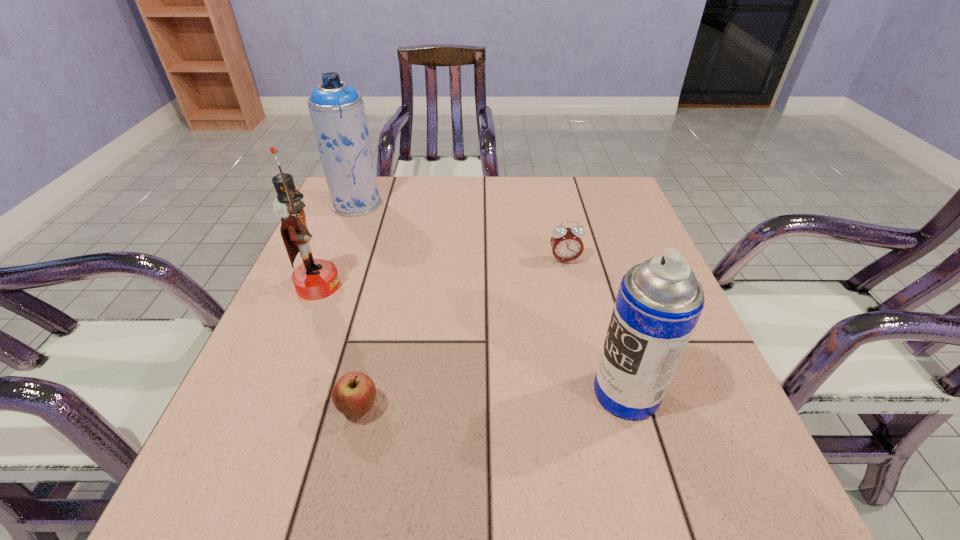
This screenshot has height=540, width=960. I want to click on the farthest object, so [x=337, y=111].

You are a GUI agent. You are given a task and a screenshot of the screen. Output one action in this format:
    pyautogui.click(x=<x>, y=<y>)
    Task: Click on the farther aerosol can
    
    Given the screenshot: What is the action you would take?
    pyautogui.click(x=337, y=111)

What are the coordinates of `the third farthest object` in the screenshot? It's located at (314, 279).

In order to click on the right aerosol can in this screenshot , I will do `click(659, 302)`.

At what (x,y) coordinates should I click in order to perform the action: click on alarm clock. Please return your answer as a coordinate pair (x, y). Looking at the image, I should click on (566, 243).

Identify the location of the second shortest object. (566, 243).

I want to click on the shortest object, so click(x=354, y=394).

Identify the location of the third object from right to left. Image resolution: width=960 pixels, height=540 pixels. (354, 394).

Find the location of a particular element. This screenshot has width=960, height=540. blank space located on the right of the farthest object is located at coordinates (440, 204).

Image resolution: width=960 pixels, height=540 pixels. What are the coordinates of `vacant region located on the front-facing side of the third nearest object` in the screenshot? It's located at (368, 286).